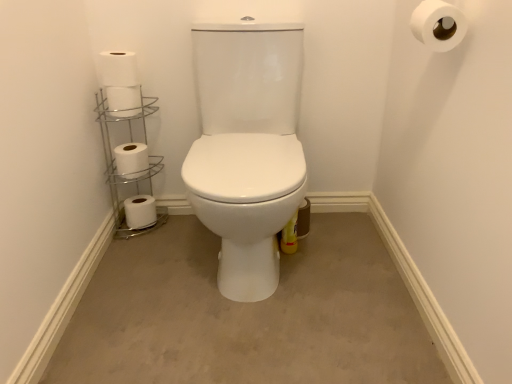
Question: Considering the relative sizes of silver/metallic toilet paper holder at left and beige carpet at center in the image provided, is silver/metallic toilet paper holder at left bigger than beige carpet at center?

Choices:
 (A) no
 (B) yes

Answer: (A)

Question: Considering the relative sizes of silver/metallic toilet paper holder at left and beige carpet at center in the image provided, is silver/metallic toilet paper holder at left taller than beige carpet at center?

Choices:
 (A) yes
 (B) no

Answer: (A)

Question: Is silver/metallic toilet paper holder at left to the left of beige carpet at center from the viewer's perspective?

Choices:
 (A) no
 (B) yes

Answer: (B)

Question: Can you confirm if silver/metallic toilet paper holder at left is shorter than beige carpet at center?

Choices:
 (A) no
 (B) yes

Answer: (A)

Question: Is silver/metallic toilet paper holder at left directly adjacent to beige carpet at center?

Choices:
 (A) no
 (B) yes

Answer: (A)

Question: From the image's perspective, is silver/metallic toilet paper holder at left beneath beige carpet at center?

Choices:
 (A) yes
 (B) no

Answer: (B)

Question: Would you say white matte toilet paper at lower left, the 1th toilet paper viewed from the left, contains white matte toilet paper at upper left, which is the second toilet paper from front to back?

Choices:
 (A) yes
 (B) no

Answer: (B)

Question: Is white matte toilet paper at lower left, marked as the first toilet paper in a back-to-front arrangement, facing towards white matte toilet paper at upper left, which is the second toilet paper from front to back?

Choices:
 (A) yes
 (B) no

Answer: (B)

Question: Is there a large distance between white matte toilet paper at lower left, marked as the first toilet paper in a back-to-front arrangement, and white matte toilet paper at upper left, which is the fourth toilet paper from back to front?

Choices:
 (A) yes
 (B) no

Answer: (B)

Question: From the image's perspective, is white matte toilet paper at lower left, the 1th toilet paper viewed from the left, on white matte toilet paper at upper left, the 1th toilet paper viewed from the top?

Choices:
 (A) no
 (B) yes

Answer: (A)

Question: Are white matte toilet paper at lower left, the 5th toilet paper positioned from the front, and white matte toilet paper at upper left, the 2th toilet paper in the right-to-left sequence, making contact?

Choices:
 (A) no
 (B) yes

Answer: (A)

Question: Considering the relative sizes of white matte toilet paper at lower left, marked as the first toilet paper in a back-to-front arrangement, and white matte toilet paper at upper left, the 2th toilet paper in the right-to-left sequence, in the image provided, is white matte toilet paper at lower left, marked as the first toilet paper in a back-to-front arrangement, smaller than white matte toilet paper at upper left, the 2th toilet paper in the right-to-left sequence,?

Choices:
 (A) no
 (B) yes

Answer: (B)

Question: Is white matte toilet paper at lower left, marked as the first toilet paper in a back-to-front arrangement, at the left side of white matte toilet paper at upper right, the fifth toilet paper when ordered from left to right?

Choices:
 (A) no
 (B) yes

Answer: (B)